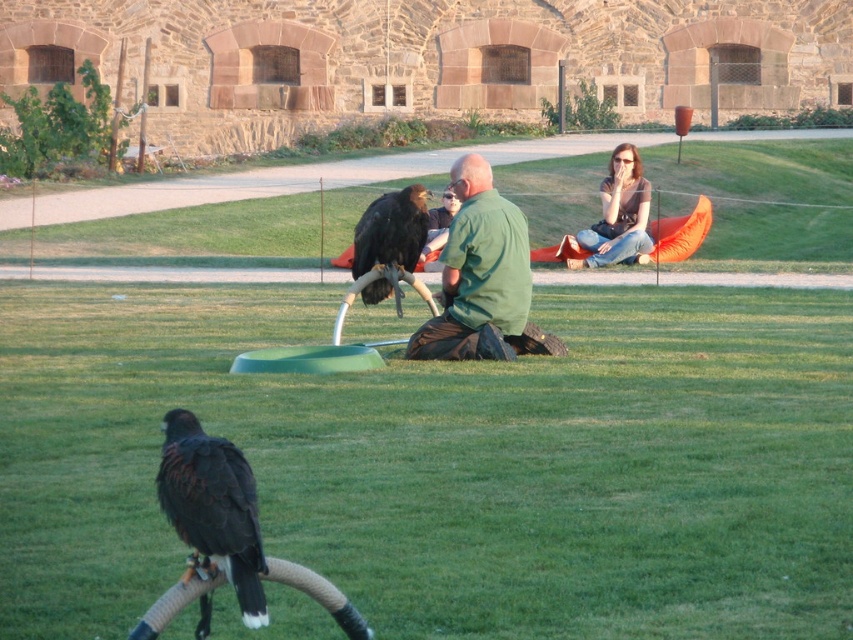
You are a photographer standing at the point marked as point (480, 276). You want to take a photo of the green matte shirt at center. Is the green matte shirt at center visible from your current position?

The green matte shirt at center is located at point (480, 276), so yes, it is visible from your current position.

In the scene shown: You are standing in the park and see the black feathered eagle at lower left. If you want to take a photo of it with your phone, which has a maximum zoom range of 5 meters, will you be able to get a clear closeup without moving closer?

The black feathered eagle at lower left is 7.11 meters from viewer. Since the maximum zoom is 5 meters, you won not be able to get a clear closeup without moving closer.